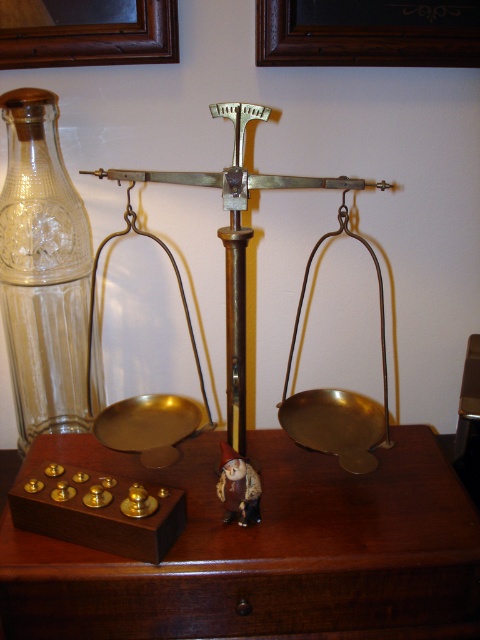
You are trying to place the wooden picture frame at upper center on top of the brown wooden table at center. Will it fit without touching the floor?

The brown wooden table at center has a greater height compared to wooden picture frame at upper center, so placing the wooden picture frame at upper center on top of the brown wooden table at center will work as it won

You are standing in front of the vintage brass balance scale and want to place an object at point A and point B. Point A is at coordinate point (346, 621) and point B is at coordinate point (444, 20). Which point is closer to you?

Point A at coordinate point (346, 621) is closer to you than point B at coordinate point (444, 20).

You are organizing a display and need to place both the brown wooden table at center and the brown wooden picture frame at upper left on a shelf. The shelf has limited height clearance. Which object should you place first to ensure it fits under the shelf height limit?

The brown wooden picture frame at upper left should be placed first because it is shorter than the brown wooden table at center, which is taller and may exceed the shelf height clearance.